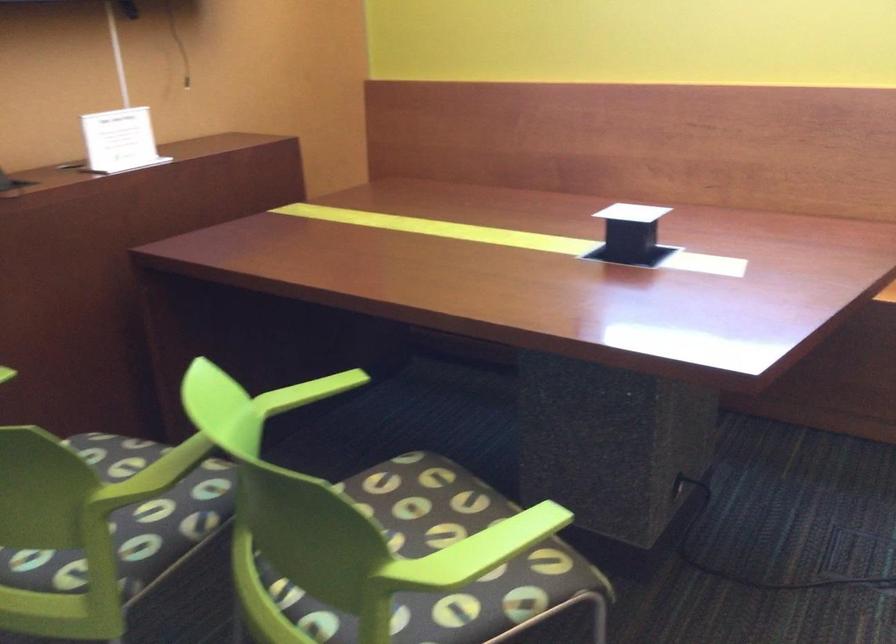
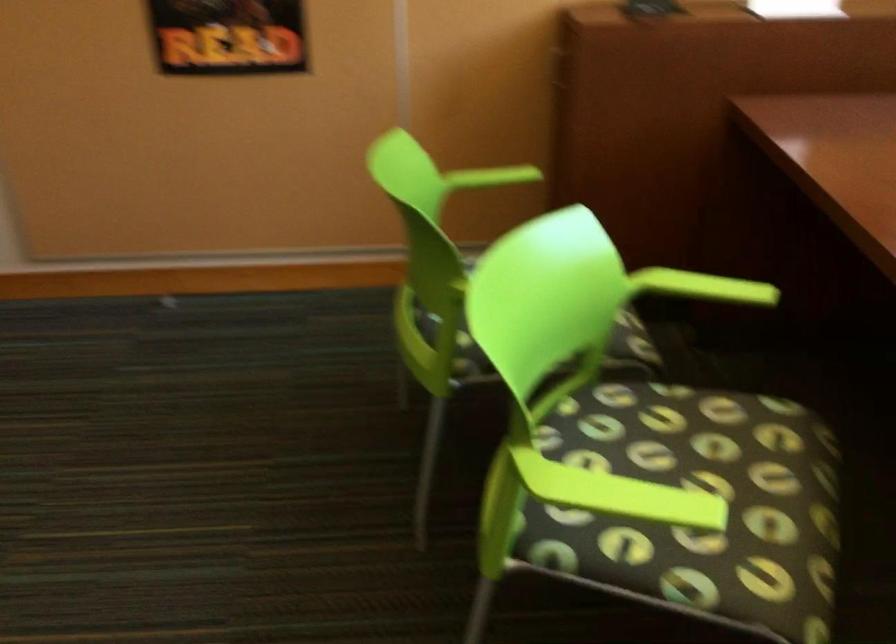
Locate, in the second image, the point that corresponds to [309,391] in the first image.

(702, 287)